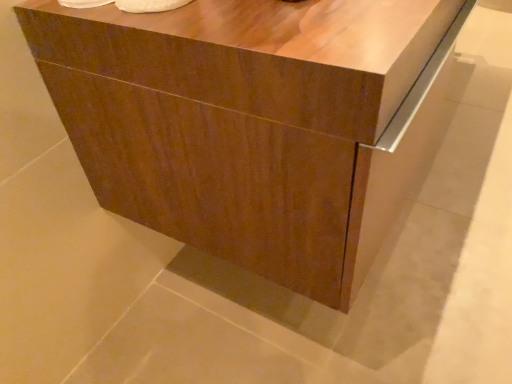
Describe the element at coordinates (255, 122) in the screenshot. I see `matte wood chest of drawers at center` at that location.

You are a GUI agent. You are given a task and a screenshot of the screen. Output one action in this format:
    pyautogui.click(x=<x>, y=<y>)
    Task: Click on the matte wood chest of drawers at center
    The image size is (512, 384).
    Given the screenshot: What is the action you would take?
    pyautogui.click(x=255, y=122)

Locate an element on the screen. This screenshot has width=512, height=384. matte wood chest of drawers at center is located at coordinates (x=255, y=122).